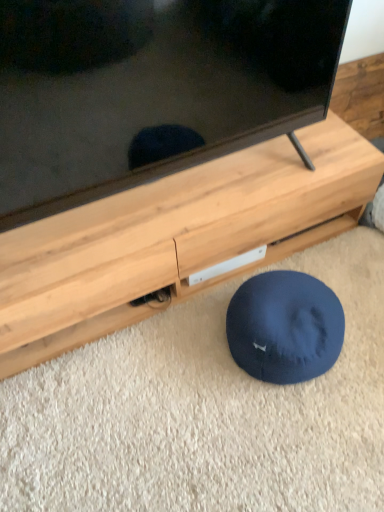
Question: Considering the relative positions of navy blue fabric dog bed at lower center and black glossy tv at upper center in the image provided, is navy blue fabric dog bed at lower center behind black glossy tv at upper center?

Choices:
 (A) yes
 (B) no

Answer: (A)

Question: Is the surface of navy blue fabric dog bed at lower center in direct contact with black glossy tv at upper center?

Choices:
 (A) yes
 (B) no

Answer: (B)

Question: Is navy blue fabric dog bed at lower center far from black glossy tv at upper center?

Choices:
 (A) no
 (B) yes

Answer: (A)

Question: Considering the relative sizes of navy blue fabric dog bed at lower center and black glossy tv at upper center in the image provided, is navy blue fabric dog bed at lower center thinner than black glossy tv at upper center?

Choices:
 (A) yes
 (B) no

Answer: (B)

Question: From a real-world perspective, is navy blue fabric dog bed at lower center physically above black glossy tv at upper center?

Choices:
 (A) no
 (B) yes

Answer: (A)

Question: From the image's perspective, is navy blue fabric dog bed at lower center below black glossy tv at upper center?

Choices:
 (A) no
 (B) yes

Answer: (B)

Question: Considering the relative sizes of navy blue fabric dog bed at lower center and wooden tv stand at center in the image provided, is navy blue fabric dog bed at lower center thinner than wooden tv stand at center?

Choices:
 (A) no
 (B) yes

Answer: (B)

Question: From the image's perspective, would you say navy blue fabric dog bed at lower center is shown under wooden tv stand at center?

Choices:
 (A) yes
 (B) no

Answer: (A)

Question: Does navy blue fabric dog bed at lower center have a larger size compared to wooden tv stand at center?

Choices:
 (A) no
 (B) yes

Answer: (A)

Question: Is navy blue fabric dog bed at lower center closer to camera compared to wooden tv stand at center?

Choices:
 (A) no
 (B) yes

Answer: (A)

Question: Is navy blue fabric dog bed at lower center touching wooden tv stand at center?

Choices:
 (A) no
 (B) yes

Answer: (A)

Question: Is navy blue fabric dog bed at lower center shorter than wooden tv stand at center?

Choices:
 (A) no
 (B) yes

Answer: (B)

Question: Could you tell me if wooden tv stand at center is turned towards navy blue fabric dog bed at lower center?

Choices:
 (A) yes
 (B) no

Answer: (A)